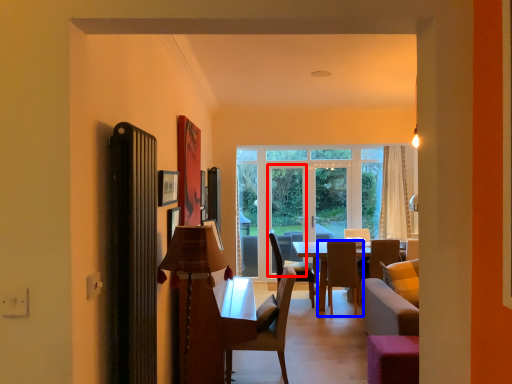
Question: Among these objects, which one is farthest to the camera, screen door (highlighted by a red box) or chair (highlighted by a blue box)?

Choices:
 (A) screen door
 (B) chair

Answer: (A)